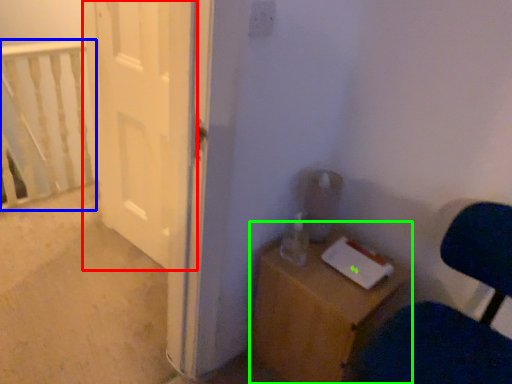
Question: Which is farther away from door (highlighted by a red box)? rail (highlighted by a blue box) or furniture (highlighted by a green box)?

Choices:
 (A) rail
 (B) furniture

Answer: (B)